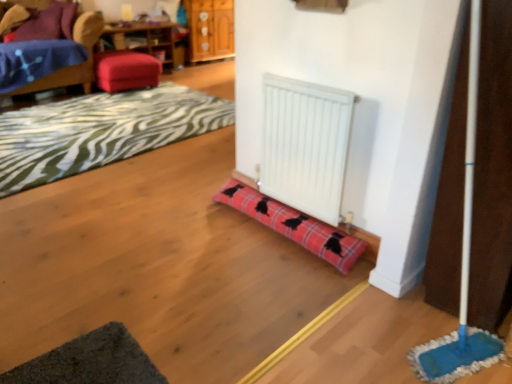
Find the location of `vacant space to the left of red plaid doorstop at center`. vacant space to the left of red plaid doorstop at center is located at coordinates (178, 226).